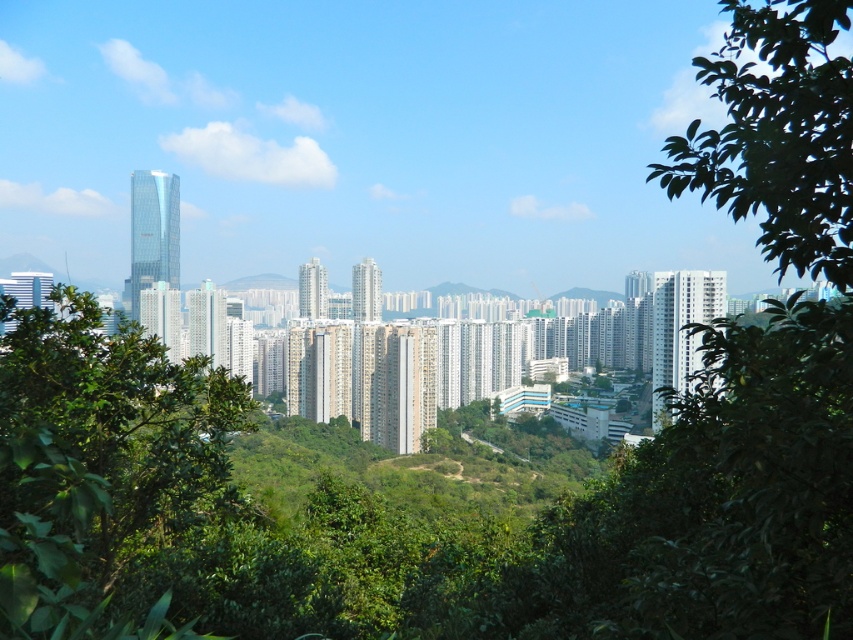
You are standing at the center of the image and want to locate the green leafy tree at left. In which direction should you look to find it?

The green leafy tree at left is located at point (99, 464), so you should look to the left side of the image to find it.

You are a bird flying over the city. You see the green leafy tree at left and the green leafy tree at upper right. Which tree is closer to the ground?

The green leafy tree at left is closer to the ground because it is positioned below the green leafy tree at upper right.

You are standing in a city park surrounded by greenery and looking at the cityscape. You notice two points in the distance. The first point is at coordinate point (123,364) and the second is at coordinate point (816,262). Which point is closer to you?

Point (123,364) is closer to the viewer than point (816,262).